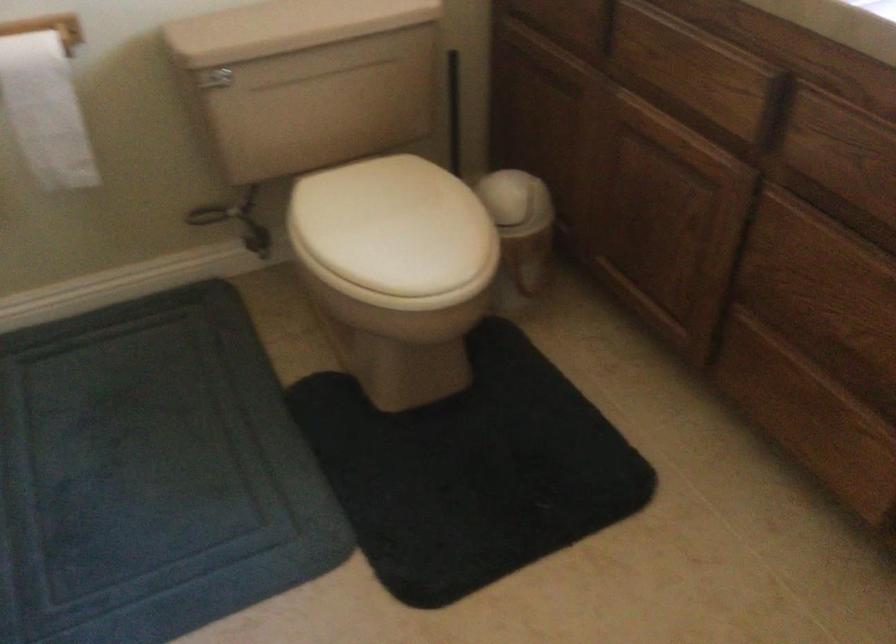
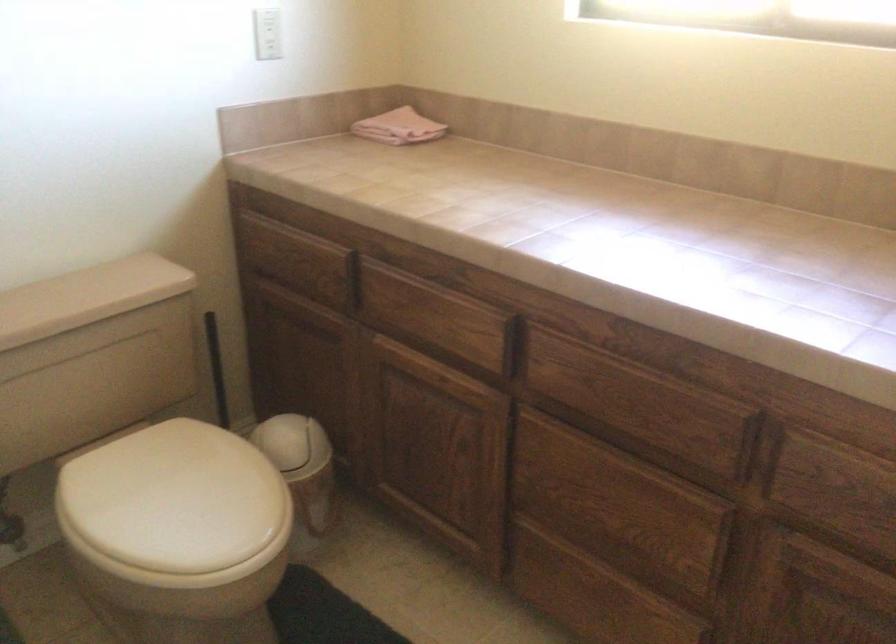
Where in the second image is the point corresponding to point 386,222 from the first image?

(176, 500)